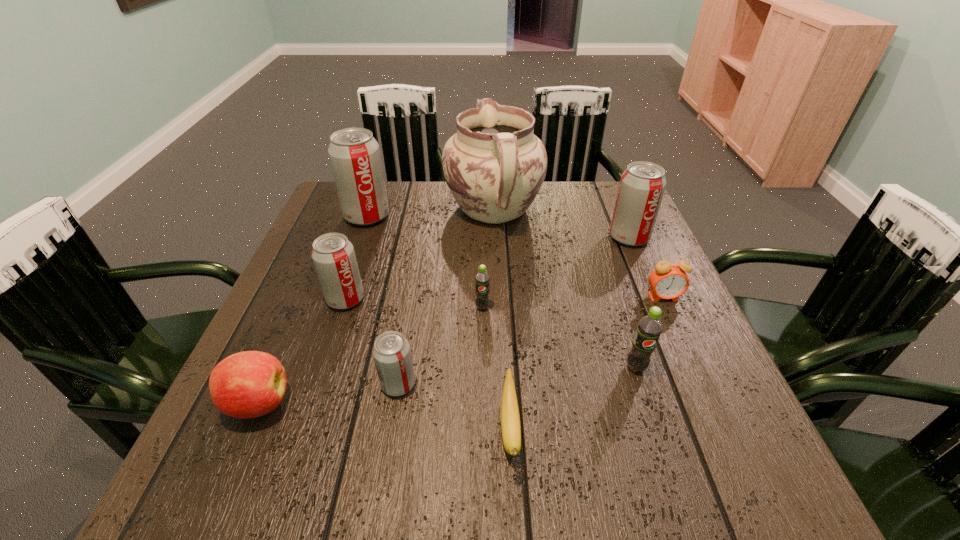
At what (x,y) coordinates should I click in order to perform the action: click on purple pitcher. Please return your answer as a coordinate pair (x, y). The height and width of the screenshot is (540, 960). Looking at the image, I should click on (494, 166).

Where is `the biggest gray soda can`? The width and height of the screenshot is (960, 540). the biggest gray soda can is located at coordinates (354, 154).

Identify the location of the tallest soda can. (354, 154).

Find the location of `the rightmost soda can`. the rightmost soda can is located at coordinates (642, 185).

The image size is (960, 540). Find the location of `the fifth shortest soda can`. the fifth shortest soda can is located at coordinates (642, 185).

In order to click on the third farthest gray soda can in this screenshot , I will do click(333, 255).

This screenshot has width=960, height=540. Find the location of `the bigger green soda`. the bigger green soda is located at coordinates (649, 328).

Identify the location of the third object from right to left. Image resolution: width=960 pixels, height=540 pixels. (649, 328).

Find the location of a particular element. The image size is (960, 540). the third soda can from right to left is located at coordinates (482, 279).

You are a GUI agent. You are given a task and a screenshot of the screen. Output one action in this format:
    pyautogui.click(x=<x>, y=<y>)
    Task: Click on the left green soda
    Image resolution: width=960 pixels, height=540 pixels.
    Given the screenshot: What is the action you would take?
    pyautogui.click(x=482, y=279)